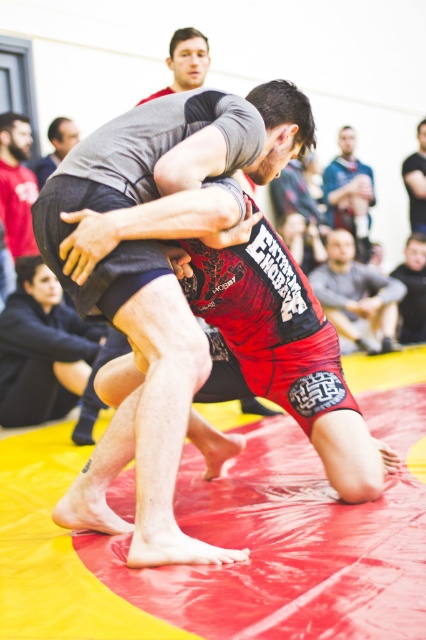
Question: Is dark gray fabric shirt at lower left wider than matte gray shirt at upper left?

Choices:
 (A) no
 (B) yes

Answer: (B)

Question: Considering the real-world distances, which object is closest to the dark gray fabric shirt at lower left?

Choices:
 (A) dark gray fabric shirt at upper center
 (B) blue fabric shirt at upper center

Answer: (A)

Question: Does dark gray fabric shirt at lower left have a greater width compared to dark gray fabric shirt at upper center?

Choices:
 (A) yes
 (B) no

Answer: (A)

Question: Does dark gray fabric shirt at lower left appear over smooth gray shirt at upper center?

Choices:
 (A) no
 (B) yes

Answer: (A)

Question: Which is nearer to the blue fabric shirt at upper center?

Choices:
 (A) dark gray fabric shirt at upper center
 (B) dark gray fabric shirt at lower left
 (C) smooth black t-shirt at upper center

Answer: (C)

Question: Considering the real-world distances, which object is closest to the dark gray fabric shirt at upper center?

Choices:
 (A) dark gray fabric shirt at lower left
 (B) smooth black t-shirt at upper center
 (C) red fabric pants at lower right

Answer: (C)